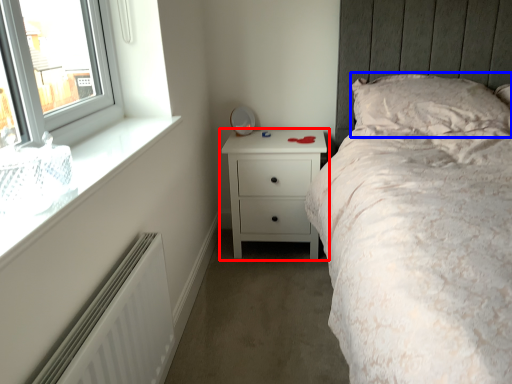
Question: Which of the following is the closest to the observer, chest of drawers (highlighted by a red box) or pillow (highlighted by a blue box)?

Choices:
 (A) chest of drawers
 (B) pillow

Answer: (B)